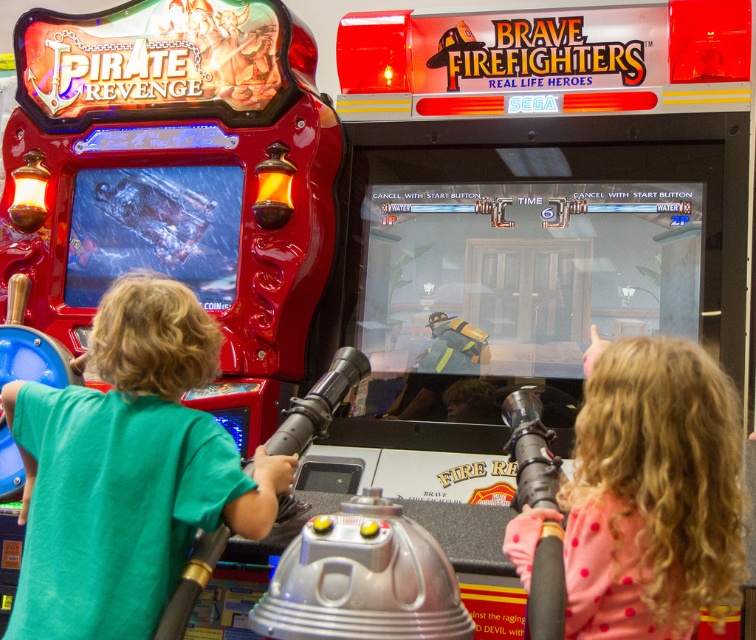
You are a customer in an arcade looking at two shirts displayed on mannequins next to the games. The shirts are the green matte shirt at left and the pink dotted shirt at right. Which shirt is positioned higher on its respective mannequin?

The green matte shirt at left is located above the pink dotted shirt at right, meaning it is positioned higher on its mannequin.

You are trying to decide which shirt to buy based on size. You want a larger shirt. Which one should you choose between the green matte shirt at left and the pink dotted shirt at right?

The pink dotted shirt at right is larger than the green matte shirt at left, so you should choose the pink dotted shirt at right.